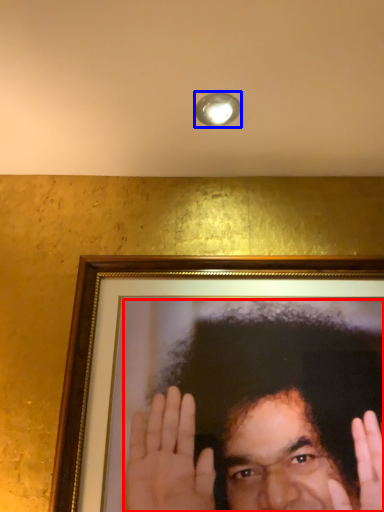
Question: Among these objects, which one is nearest to the camera, man (highlighted by a red box) or light fixture (highlighted by a blue box)?

Choices:
 (A) man
 (B) light fixture

Answer: (A)